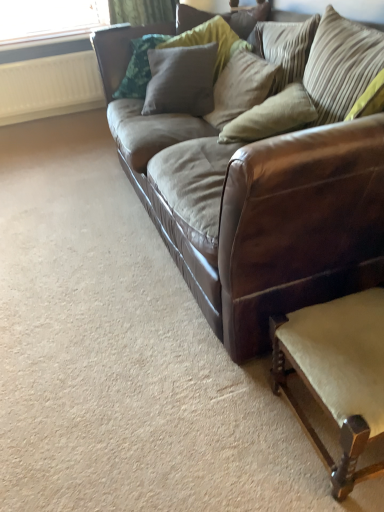
In order to click on free location above white ribbed radiator at upper left (from a real-world perspective) in this screenshot , I will do `click(40, 57)`.